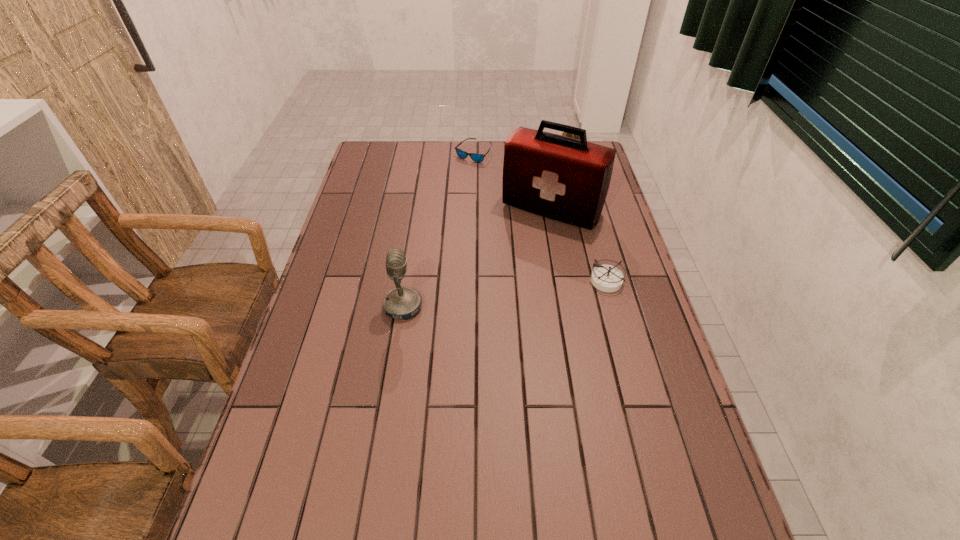
Identify the location of vacant space in between the shorter compass and the first aid kit. (580, 245).

Locate an element on the screen. This screenshot has width=960, height=540. free space between the microphone and the shorter compass is located at coordinates (505, 294).

At what (x,y) coordinates should I click in order to perform the action: click on free spot between the second tallest object and the tallest object. Please return your answer as a coordinate pair (x, y). Looking at the image, I should click on (477, 258).

Where is `empty space between the third tallest object and the leftmost object`? empty space between the third tallest object and the leftmost object is located at coordinates (487, 231).

The image size is (960, 540). I want to click on free point between the second shortest object and the second tallest object, so click(505, 294).

I want to click on vacant space in between the fourth shortest object and the sunglasses, so click(x=438, y=230).

Locate which object ranks third in proximity to the fourth object from right to left. Please provide its 2D coordinates. Your answer should be formatted as a tuple, i.e. [(x, y)], where the tuple contains the x and y coordinates of a point satisfying the conditions above.

[(606, 278)]

Identify which object is the fourth closest to the second shortest object. Please provide its 2D coordinates. Your answer should be formatted as a tuple, i.e. [(x, y)], where the tuple contains the x and y coordinates of a point satisfying the conditions above.

[(475, 157)]

Identify the location of free location that satisfies the following two spatial constraints: 1. on the front side of the farther compass; 2. on the left side of the fourth object from right to left. The height and width of the screenshot is (540, 960). (473, 156).

The height and width of the screenshot is (540, 960). Identify the location of free space in the image that satisfies the following two spatial constraints: 1. on the back side of the third shortest object; 2. on the left side of the first aid kit. (541, 156).